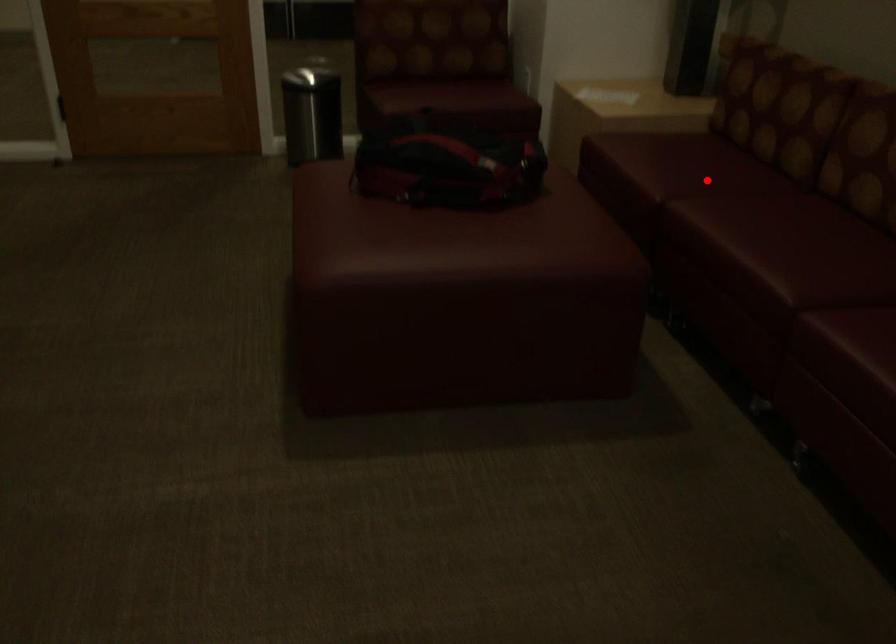
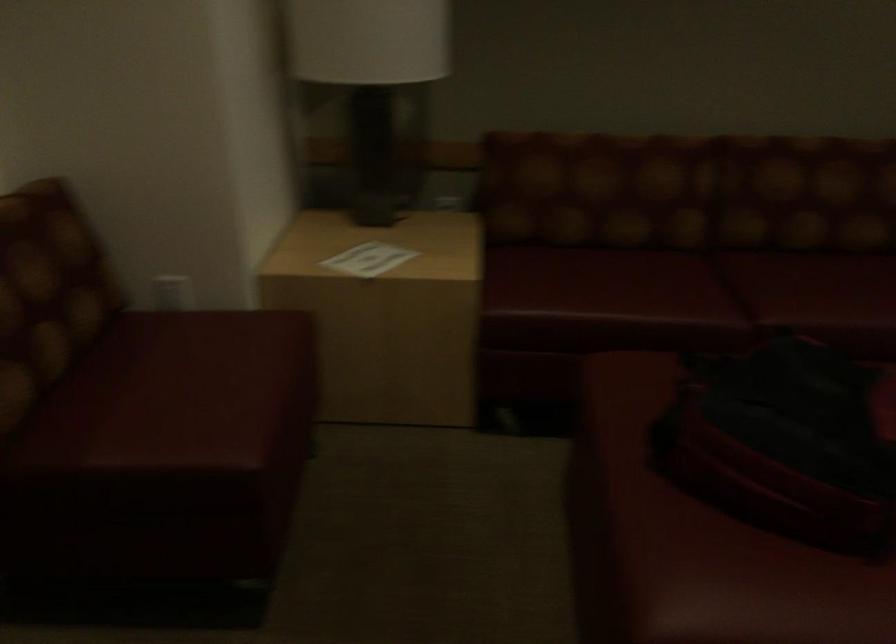
Question: A red point is marked in image1. In image2, is the corresponding 3D point closer to the camera or farther? Reply with the corresponding letter.

Choices:
 (A) The corresponding 3D point is closer.
 (B) The corresponding 3D point is farther.

Answer: (A)